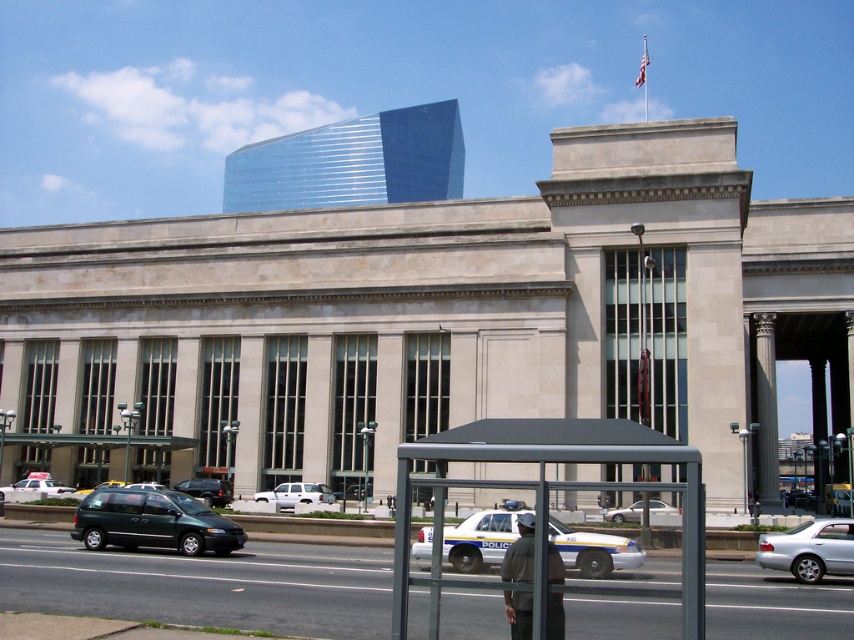
You are a delivery driver who needs to park your green matte minivan at lower left next to the white glossy police car at center. Can your minivan fit in the parking space if the space is designed for vehicles the size of the police car?

The green matte minivan at lower left is wider than the white glossy police car at center, so it may not fit properly in a parking space designed for the police car.

You are standing at the bus stop shelter and want to take a photo of the classical building without any vehicles in the frame. The green matte minivan at lower left is blocking your view. Can you move to the right or left to avoid it?

Since the green matte minivan at lower left is located at point 0.817 on the x axis, moving to the left would place you further away from the minivan, potentially allowing you to frame the classical building without it obstructing the view.